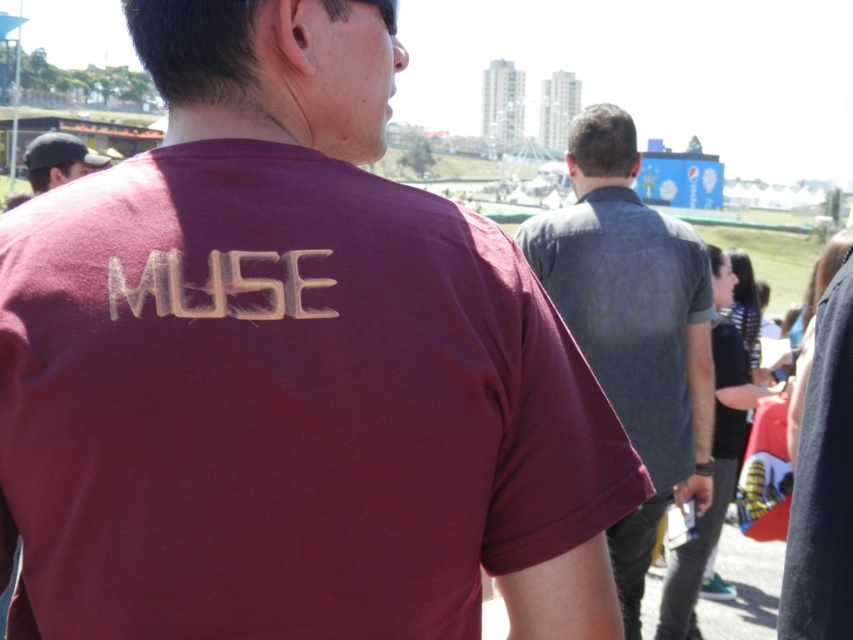
Can you confirm if denim shirt at center is bigger than black fabric at center?

No, denim shirt at center is not bigger than black fabric at center.

This screenshot has width=853, height=640. Describe the element at coordinates (631, 324) in the screenshot. I see `denim shirt at center` at that location.

Describe the element at coordinates (631, 324) in the screenshot. I see `denim shirt at center` at that location.

Image resolution: width=853 pixels, height=640 pixels. What are the coordinates of `denim shirt at center` in the screenshot? It's located at [x=631, y=324].

Is point (258, 260) closer to camera compared to point (837, 499)?

Yes, it is in front of point (837, 499).

Which is in front, point (505, 422) or point (821, 576)?

Positioned in front is point (505, 422).

Does point (490, 376) come behind point (817, 413)?

No, it is not.

The image size is (853, 640). In order to click on maroon fabric t-shirt at center in this screenshot , I will do `click(282, 404)`.

Measure the distance between maroon fabric t-shirt at center and matte black cap at upper left.

A distance of 112.67 feet exists between maroon fabric t-shirt at center and matte black cap at upper left.

Can you confirm if maroon fabric t-shirt at center is positioned to the right of matte black cap at upper left?

Indeed, maroon fabric t-shirt at center is positioned on the right side of matte black cap at upper left.

Is point (234, 349) closer to viewer compared to point (57, 173)?

Yes, point (234, 349) is in front of point (57, 173).

Image resolution: width=853 pixels, height=640 pixels. I want to click on maroon fabric t-shirt at center, so click(x=282, y=404).